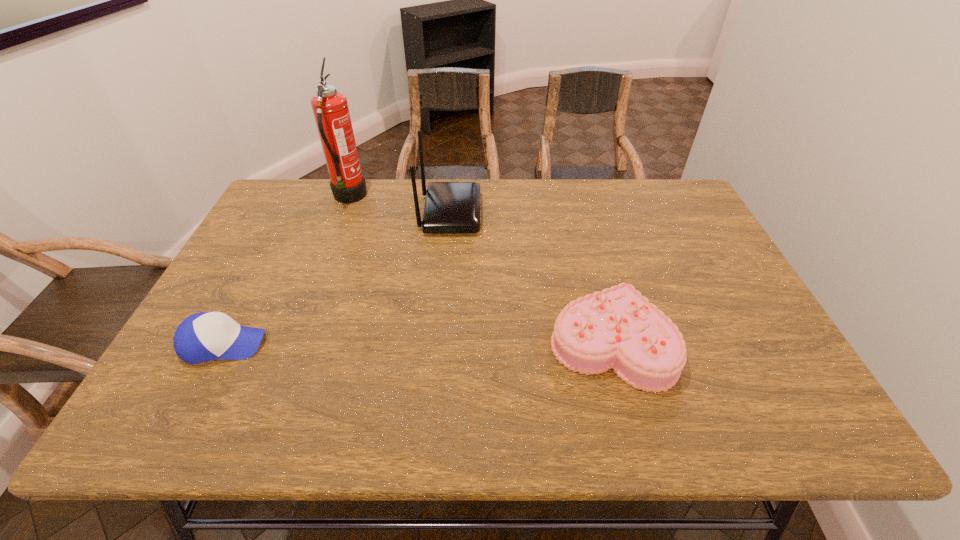
This screenshot has height=540, width=960. I want to click on the second object from left to right, so click(x=330, y=108).

Locate an element on the screen. the tallest object is located at coordinates (330, 108).

The width and height of the screenshot is (960, 540). I want to click on the third object from left to right, so click(450, 207).

Identify the location of the second tallest object. Image resolution: width=960 pixels, height=540 pixels. (450, 207).

The image size is (960, 540). What are the coordinates of `baseball cap` in the screenshot? It's located at (205, 336).

The image size is (960, 540). Find the location of `the rightmost object`. the rightmost object is located at coordinates (618, 328).

The image size is (960, 540). Identify the location of vacant space situated on the front-facing side of the tallest object. (469, 198).

At what (x,y) coordinates should I click in order to perform the action: click on vacant region located 0.330m on the front-facing side of the router. Please return your answer as a coordinate pair (x, y). Looking at the image, I should click on (586, 213).

Find the location of a particular element. vacant space positioned on the front-facing side of the leftmost object is located at coordinates (403, 345).

Image resolution: width=960 pixels, height=540 pixels. In order to click on vacant region located 0.160m on the left of the rightmost object in this screenshot , I will do `click(481, 342)`.